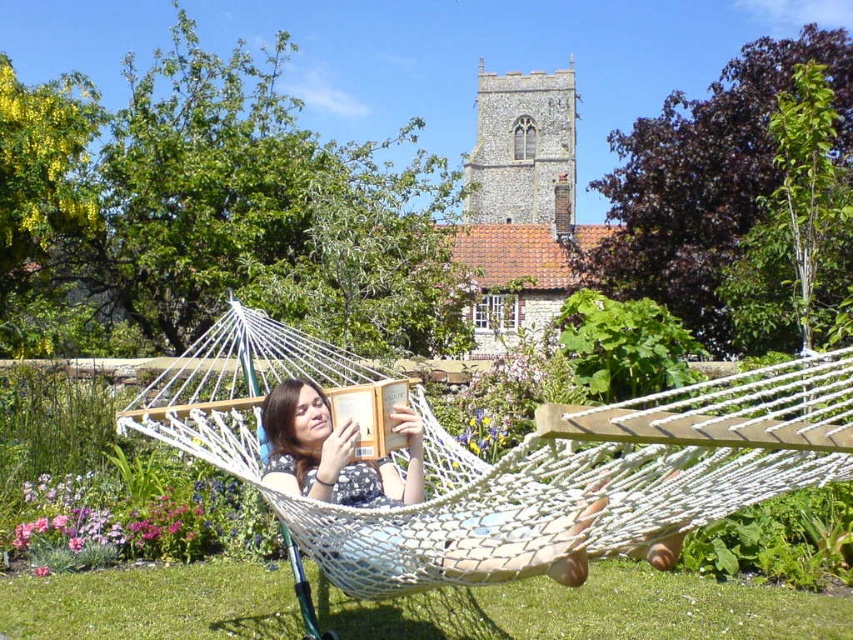
Does white mesh hammock at center have a lesser height compared to polka dot dress at center?

Incorrect, white mesh hammock at center's height does not fall short of polka dot dress at center's.

Does point (756, 449) come in front of point (527, 563)?

That is True.

Find the location of a particular element. white mesh hammock at center is located at coordinates (511, 460).